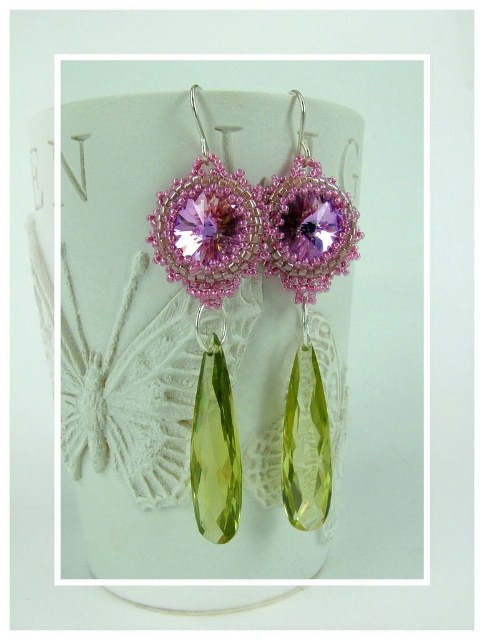
Question: Does pink beaded pearl at center come in front of matte pink glass bead at center?

Choices:
 (A) yes
 (B) no

Answer: (A)

Question: Observing the image, what is the correct spatial positioning of pink beaded pearl at center in reference to matte pink glass bead at center?

Choices:
 (A) left
 (B) right

Answer: (A)

Question: Which point is closer to the camera?

Choices:
 (A) (213, 99)
 (B) (319, 193)

Answer: (A)

Question: Which point is farther to the camera?

Choices:
 (A) (304, 426)
 (B) (104, 150)

Answer: (A)

Question: Can you confirm if pink beaded pearl at center is positioned above matte pink glass bead at center?

Choices:
 (A) yes
 (B) no

Answer: (B)